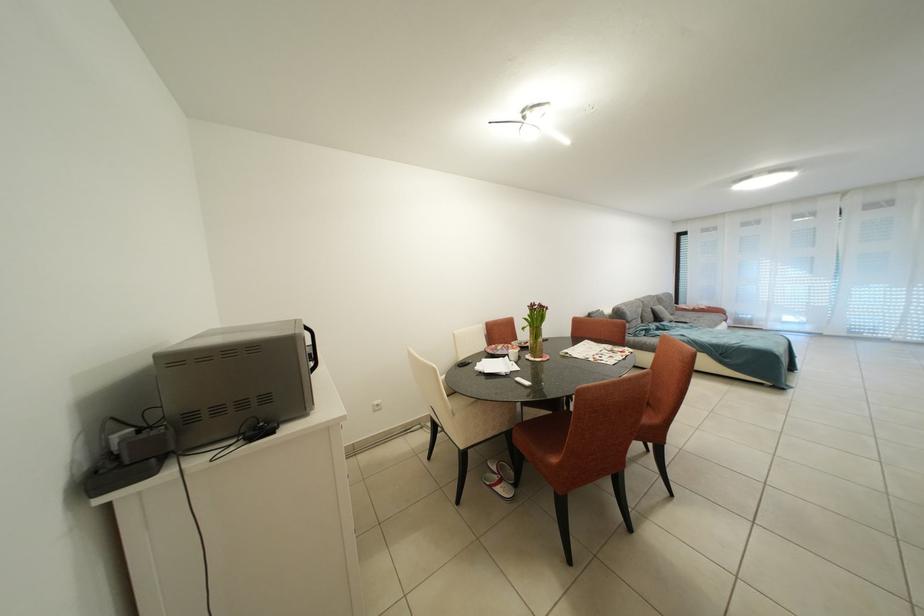
The height and width of the screenshot is (616, 924). I want to click on small white plate, so click(x=499, y=349).